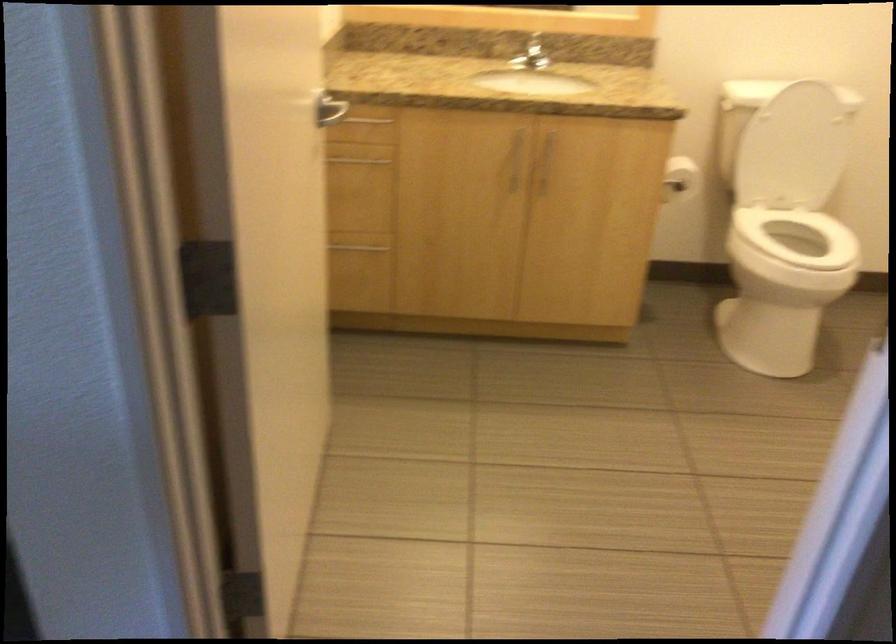
What do you see at coordinates (319, 108) in the screenshot? The image size is (896, 644). I see `the door handle` at bounding box center [319, 108].